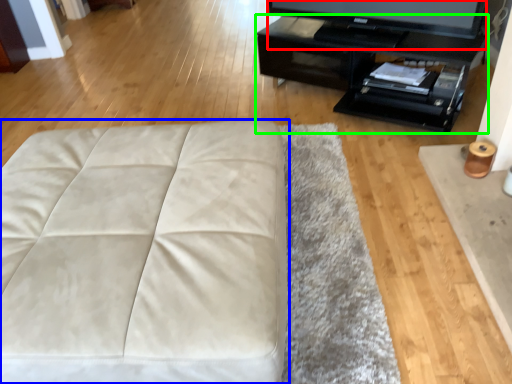
Question: Considering the real-world distances, which object is closest to television (highlighted by a red box)? furniture (highlighted by a blue box) or table (highlighted by a green box).

Choices:
 (A) furniture
 (B) table

Answer: (B)